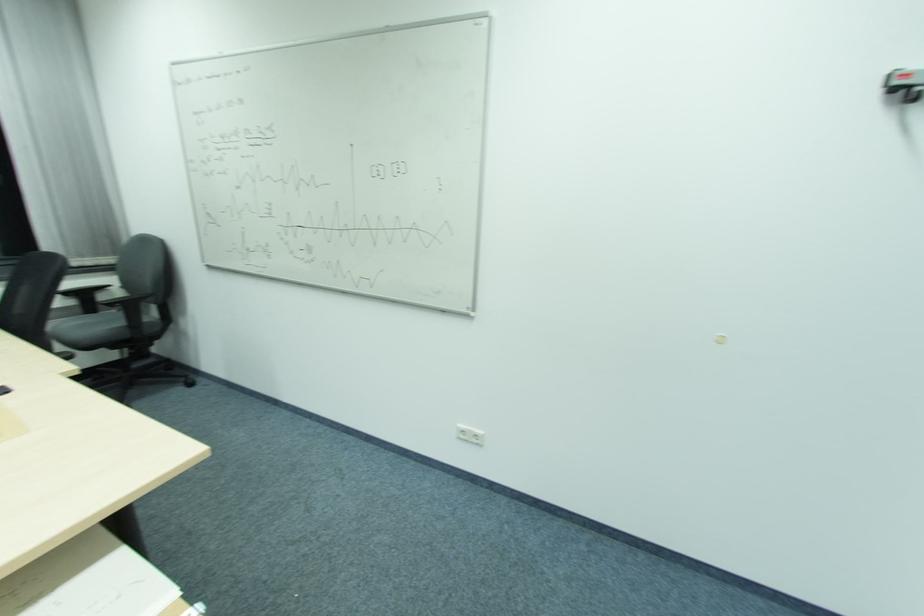
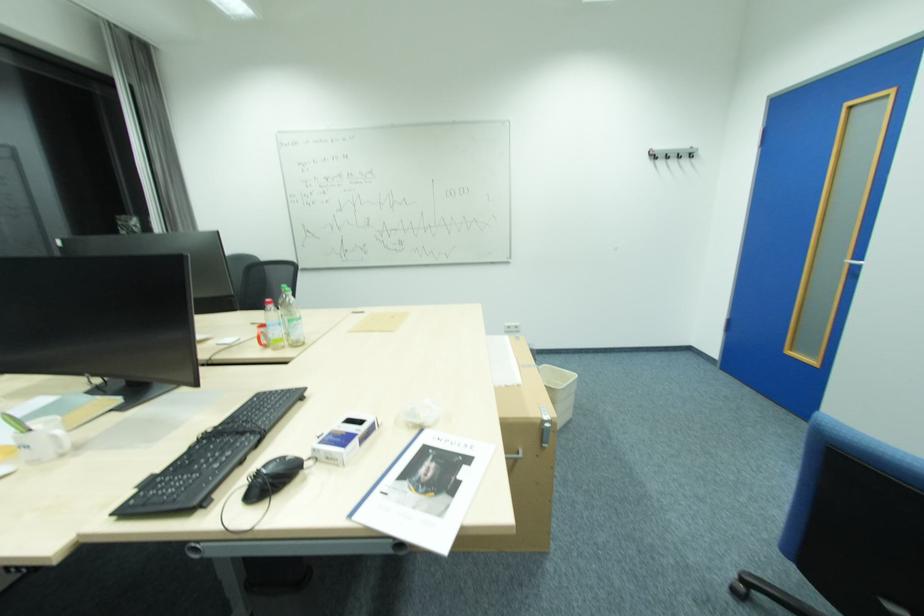
Which direction would the cameraman need to move to produce the second image?

The cameraman moved toward left, backward.